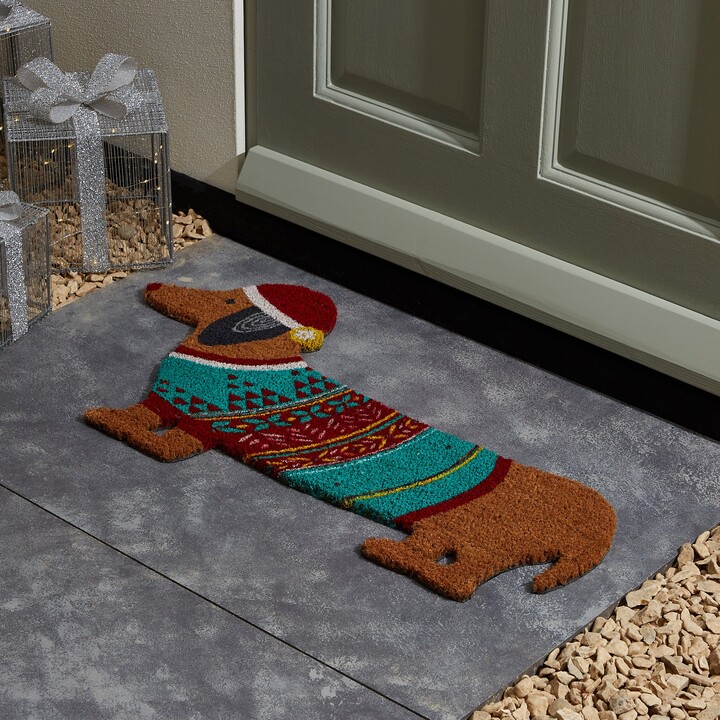
Locate an element on the screen. door is located at coordinates (610, 194).